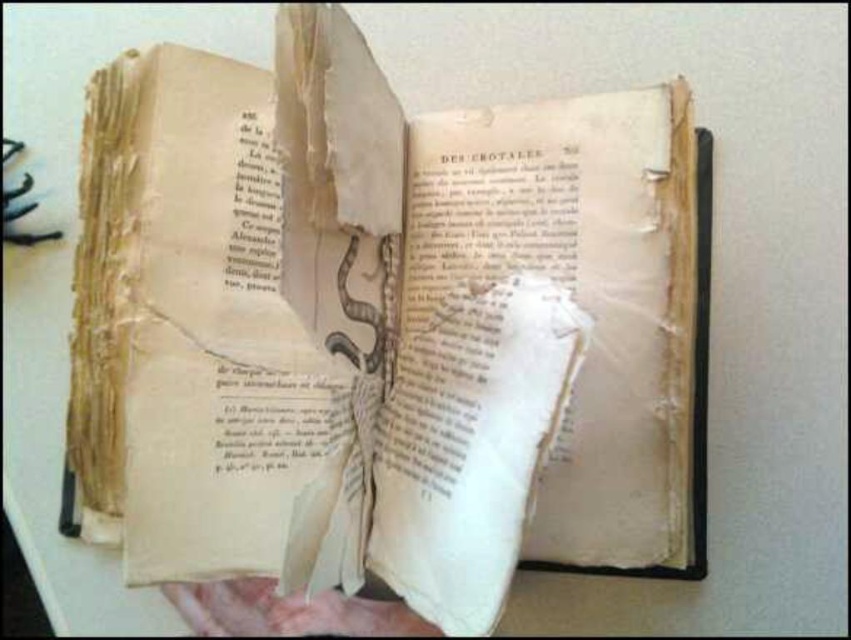
Question: Is yellowed paper book at center further to camera compared to pink flesh at lower center?

Choices:
 (A) no
 (B) yes

Answer: (A)

Question: Does yellowed paper book at center appear on the right side of pink flesh at lower center?

Choices:
 (A) no
 (B) yes

Answer: (B)

Question: Which object appears farthest from the camera in this image?

Choices:
 (A) yellowed paper book at center
 (B) pink flesh at lower center

Answer: (B)

Question: Which of the following is the farthest from the observer?

Choices:
 (A) (135, 234)
 (B) (203, 618)

Answer: (B)

Question: Does yellowed paper book at center have a greater width compared to pink flesh at lower center?

Choices:
 (A) yes
 (B) no

Answer: (A)